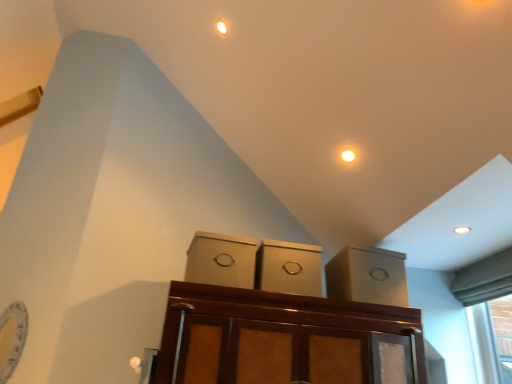
Question: Does matte cardboard box at center, acting as the first cabinetry starting from the left, have a lesser width compared to matte cardboard box at center, acting as the third cabinetry starting from the left?

Choices:
 (A) yes
 (B) no

Answer: (A)

Question: Is matte cardboard box at center, the 3th cabinetry viewed from the right, at the left side of matte cardboard box at center, which is counted as the first cabinetry, starting from the right?

Choices:
 (A) yes
 (B) no

Answer: (A)

Question: Could matte cardboard box at center, acting as the third cabinetry starting from the left, be considered to be inside matte cardboard box at center, acting as the first cabinetry starting from the left?

Choices:
 (A) no
 (B) yes

Answer: (A)

Question: Is matte cardboard box at center, acting as the first cabinetry starting from the left, next to matte cardboard box at center, acting as the third cabinetry starting from the left?

Choices:
 (A) yes
 (B) no

Answer: (B)

Question: Is matte cardboard box at center, acting as the first cabinetry starting from the left, further to the viewer compared to matte cardboard box at center, acting as the third cabinetry starting from the left?

Choices:
 (A) yes
 (B) no

Answer: (B)

Question: Based on their sizes in the image, would you say matte cardboard box at center, which is counted as the first cabinetry, starting from the right, is bigger or smaller than matte cardboard boxes at center, the second cabinetry in the right-to-left sequence?

Choices:
 (A) big
 (B) small

Answer: (A)

Question: From the image's perspective, is matte cardboard box at center, which is counted as the first cabinetry, starting from the right, above or below matte cardboard boxes at center, arranged as the 2th cabinetry when viewed from the left?

Choices:
 (A) below
 (B) above

Answer: (A)

Question: Considering their positions, is matte cardboard box at center, acting as the third cabinetry starting from the left, located in front of or behind matte cardboard boxes at center, arranged as the 2th cabinetry when viewed from the left?

Choices:
 (A) behind
 (B) front

Answer: (A)

Question: Is matte cardboard box at center, which is counted as the first cabinetry, starting from the right, to the left or to the right of matte cardboard boxes at center, arranged as the 2th cabinetry when viewed from the left, in the image?

Choices:
 (A) right
 (B) left

Answer: (A)

Question: Is point (401, 296) closer or farther from the camera than point (243, 276)?

Choices:
 (A) farther
 (B) closer

Answer: (A)

Question: Based on their sizes in the image, would you say matte cardboard box at center, which is counted as the first cabinetry, starting from the right, is bigger or smaller than matte cardboard box at center, acting as the first cabinetry starting from the left?

Choices:
 (A) small
 (B) big

Answer: (B)

Question: Based on their positions, is matte cardboard box at center, which is counted as the first cabinetry, starting from the right, located to the left or right of matte cardboard box at center, acting as the first cabinetry starting from the left?

Choices:
 (A) left
 (B) right

Answer: (B)

Question: From a real-world perspective, relative to matte cardboard box at center, acting as the first cabinetry starting from the left, is matte cardboard box at center, acting as the third cabinetry starting from the left, vertically above or below?

Choices:
 (A) below
 (B) above

Answer: (B)

Question: In terms of size, does matte cardboard box at center, the 3th cabinetry viewed from the right, appear bigger or smaller than matte cardboard boxes at center, arranged as the 2th cabinetry when viewed from the left?

Choices:
 (A) small
 (B) big

Answer: (A)

Question: Is matte cardboard box at center, acting as the first cabinetry starting from the left, in front of or behind matte cardboard boxes at center, arranged as the 2th cabinetry when viewed from the left, in the image?

Choices:
 (A) behind
 (B) front

Answer: (B)